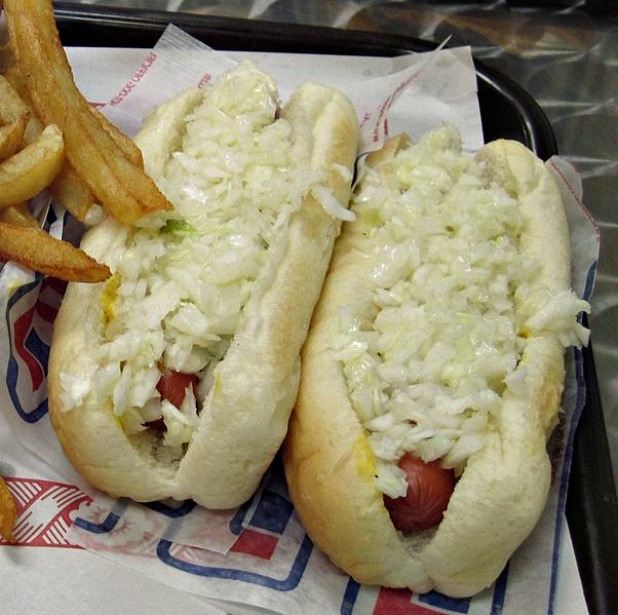
Image resolution: width=618 pixels, height=615 pixels. I want to click on black service food tray, so 509,101.